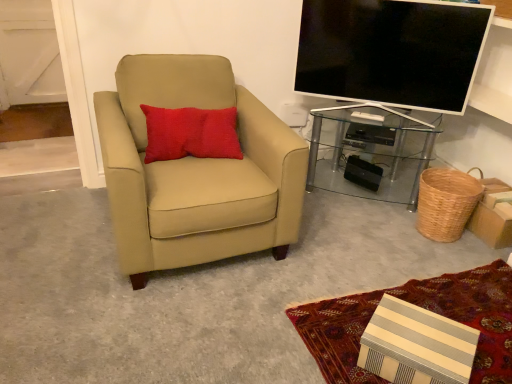
You are a GUI agent. You are given a task and a screenshot of the screen. Output one action in this format:
    pyautogui.click(x=<x>, y=<y>)
    Task: Click on the vacant space positioned to the left of woven brown basket at lower right
    Image resolution: width=512 pixels, height=384 pixels.
    Given the screenshot: What is the action you would take?
    pyautogui.click(x=384, y=222)